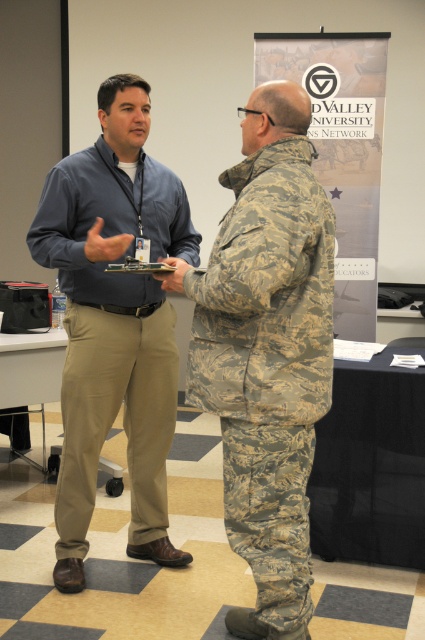
You are standing at the entrance of the conference room and see two points marked in the scene. The first point is at coordinates point (280, 189) and the second point is at point (61, 563). Which point is closer to you?

Point (280, 189) is in front of point (61, 563), so it is closer to you.

You are organizing a photo shoot and need to place two models wearing the camouflage fabric uniform at center and matte blue shirt at center in a line. Based on their heights, which model should stand in front to ensure both are visible?

The camouflage fabric uniform at center is shorter than the matte blue shirt at center, so the model wearing the camouflage fabric uniform at center should stand in front to ensure both are visible.

You are organizing a group photo and need to arrange the two people so that their uniforms fit within a 1.2 meter wide frame. Given that the camouflage fabric uniform at center is narrower than the matte blue shirt at center, which person should you place closer to the frame edges to ensure both fit?

The camouflage fabric uniform at center is narrower than the matte blue shirt at center. To fit both within the 1.2 meter frame, position the wider matte blue shirt at center near the center and the narrower camouflage fabric uniform at center closer to the edges to accommodate their widths.